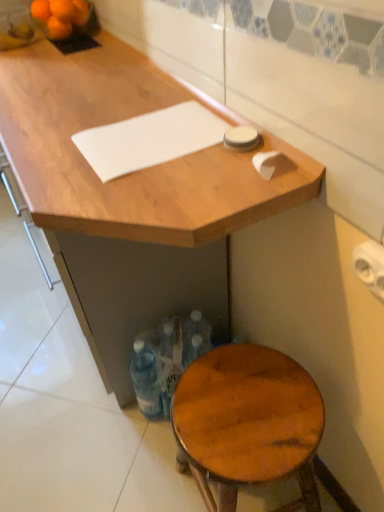
Identify the location of vacant space that is to the left of white matte cutting board at upper center. This screenshot has width=384, height=512. (51, 137).